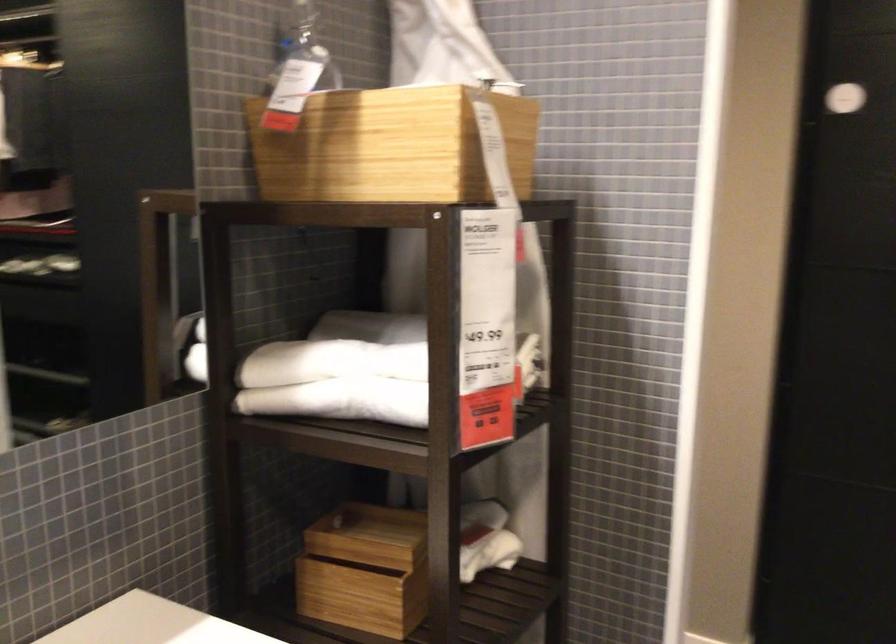
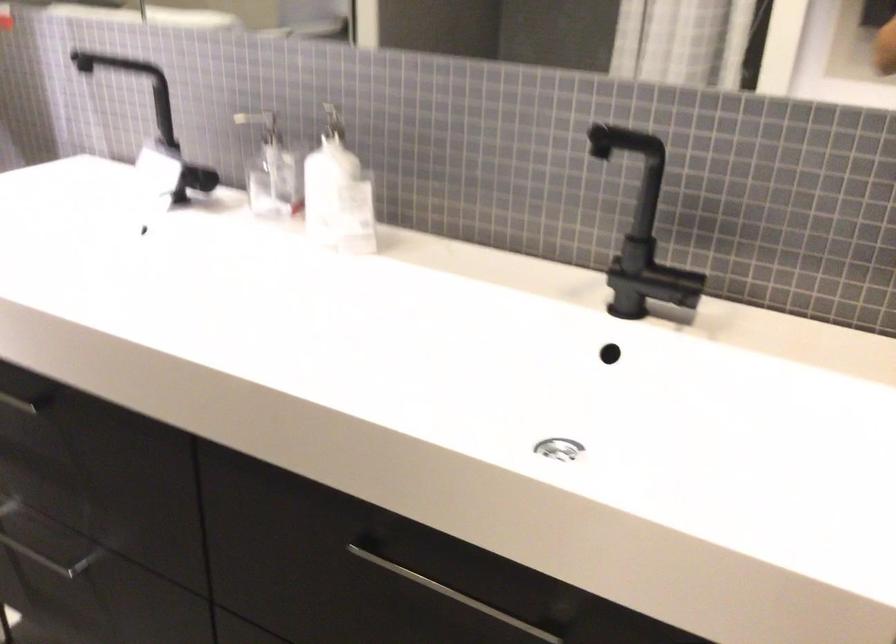
First-person continuous shooting, in which direction is the camera rotating?

The camera's rotation is toward left-down.